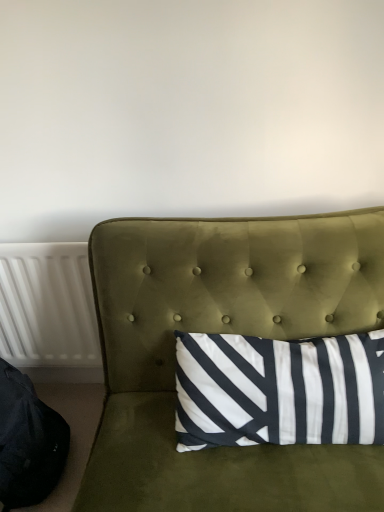
Question: Is velvet green studio couch at center taller than black fabric bean bag chair at lower left?

Choices:
 (A) yes
 (B) no

Answer: (A)

Question: Is the position of velvet green studio couch at center less distant than that of black fabric bean bag chair at lower left?

Choices:
 (A) yes
 (B) no

Answer: (A)

Question: From a real-world perspective, is velvet green studio couch at center below black fabric bean bag chair at lower left?

Choices:
 (A) no
 (B) yes

Answer: (A)

Question: Can you confirm if velvet green studio couch at center is positioned to the left of black fabric bean bag chair at lower left?

Choices:
 (A) no
 (B) yes

Answer: (A)

Question: Is velvet green studio couch at center to the right of black fabric bean bag chair at lower left from the viewer's perspective?

Choices:
 (A) no
 (B) yes

Answer: (B)

Question: Can you confirm if velvet green studio couch at center is bigger than black fabric bean bag chair at lower left?

Choices:
 (A) yes
 (B) no

Answer: (A)

Question: From a real-world perspective, is velvet green studio couch at center below white plastic radiator at left?

Choices:
 (A) no
 (B) yes

Answer: (A)

Question: Considering the relative sizes of velvet green studio couch at center and white plastic radiator at left in the image provided, is velvet green studio couch at center bigger than white plastic radiator at left?

Choices:
 (A) no
 (B) yes

Answer: (B)

Question: Is velvet green studio couch at center at the right side of white plastic radiator at left?

Choices:
 (A) yes
 (B) no

Answer: (A)

Question: Can you confirm if velvet green studio couch at center is thinner than white plastic radiator at left?

Choices:
 (A) yes
 (B) no

Answer: (B)

Question: Does velvet green studio couch at center lie in front of white plastic radiator at left?

Choices:
 (A) yes
 (B) no

Answer: (A)

Question: Is white plastic radiator at left at the back of velvet green studio couch at center?

Choices:
 (A) yes
 (B) no

Answer: (B)

Question: Considering the relative sizes of black fabric bean bag chair at lower left and white plastic radiator at left in the image provided, is black fabric bean bag chair at lower left bigger than white plastic radiator at left?

Choices:
 (A) no
 (B) yes

Answer: (B)